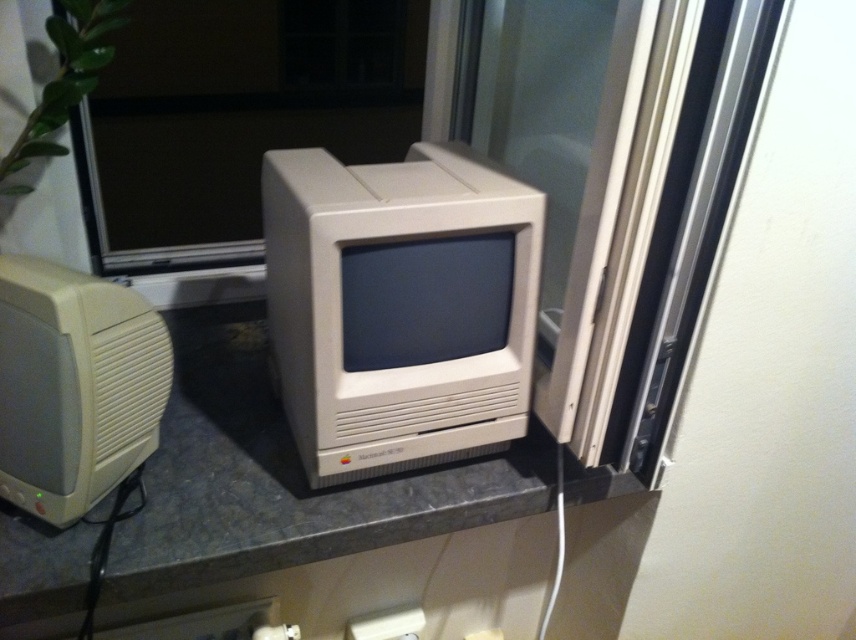
You are trying to locate a specific point on the image. The point is at coordinates (399, 307). Based on the scene description, can you determine which object this point is located on?

The point at coordinates (399, 307) is on the white plastic computer monitor at center.

You are a delivery person who needs to place a package on the windowsill where the white plastic computer monitor at center is located. The package is 30 inches long. Can the package fit horizontally on the windowsill without overlapping the monitor?

The white plastic computer monitor at center is 29.54 inches away from the viewer. Since the package is 30 inches long, it would slightly exceed the available space, making it difficult to fit without overlapping the monitor.

You are setting up a new desk next to the window. You have the beige plastic desktop computer at left and the white plastic electric outlet at lower center. Which object takes up more space on the desk?

The beige plastic desktop computer at left is larger in size than the white plastic electric outlet at lower center, so it takes up more space on the desk.